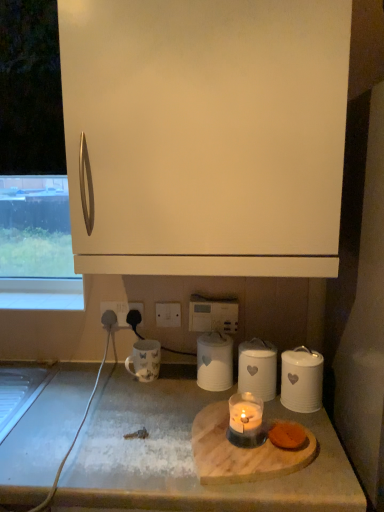
Identify the location of vacant area situated to the left side of white ceramic canister at center, which appears as the 3th kitchen appliance when viewed from the right. (163, 392).